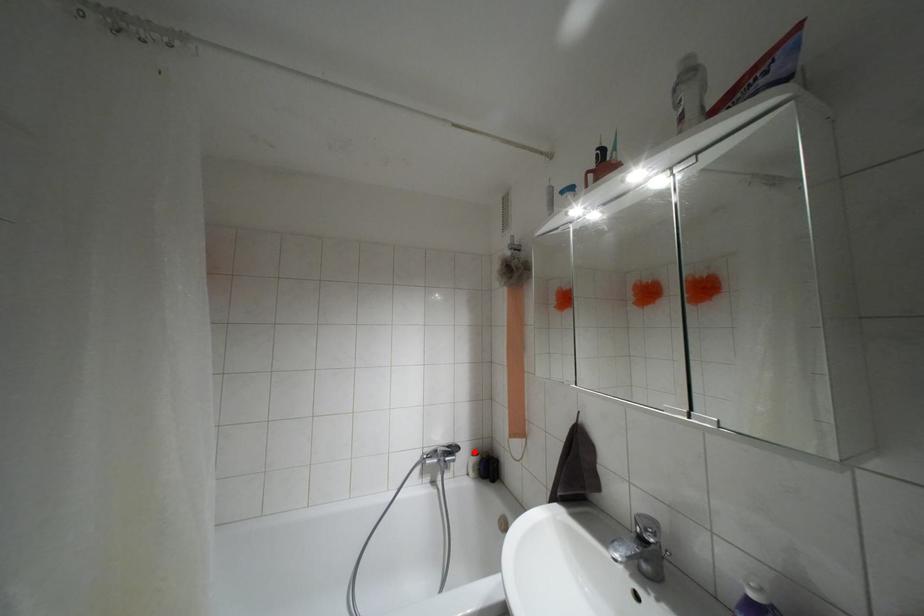
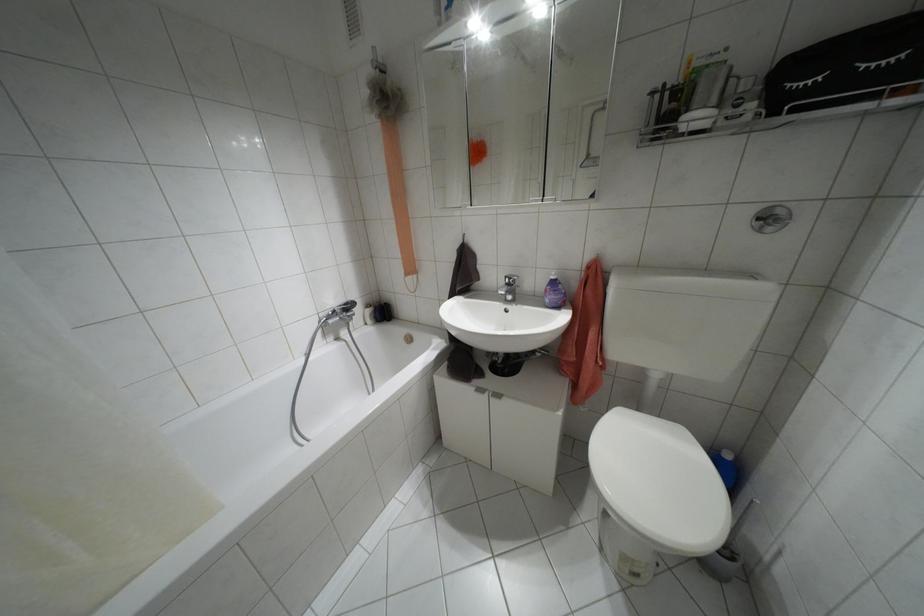
Question: I am providing you with two images of the same scene from different viewpoints. Image1 has a red point marked. In image2, the corresponding 3D location appears at what relative position? Reply with the corresponding letter.

Choices:
 (A) Closer
 (B) Farther

Answer: (A)